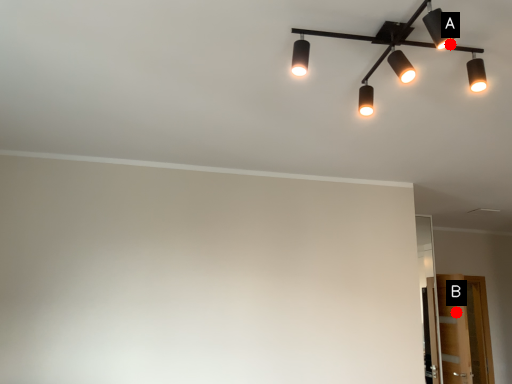
Question: Two points are circled on the image, labeled by A and B beside each circle. Which point appears farthest from the camera in this image?

Choices:
 (A) A is further
 (B) B is further

Answer: (B)